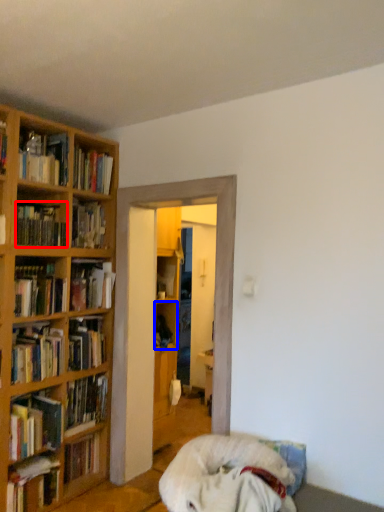
Question: Among these objects, which one is farthest to the camera, book (highlighted by a red box) or cabinet (highlighted by a blue box)?

Choices:
 (A) book
 (B) cabinet

Answer: (B)